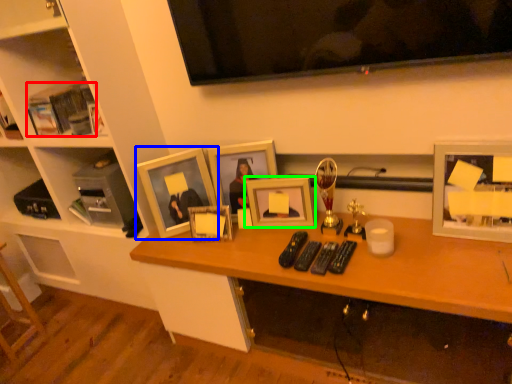
Question: Estimate the real-world distances between objects in this image. Which object is closer to book (highlighted by a red box), picture frame (highlighted by a blue box) or picture frame (highlighted by a green box)?

Choices:
 (A) picture frame
 (B) picture frame

Answer: (A)